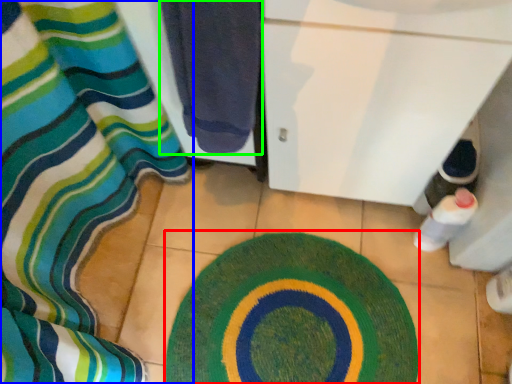
Question: Based on their relative distances, which object is farther from bath mat (highlighted by a red box)? Choose from curtain (highlighted by a blue box) and towel (highlighted by a green box).

Choices:
 (A) curtain
 (B) towel

Answer: (B)